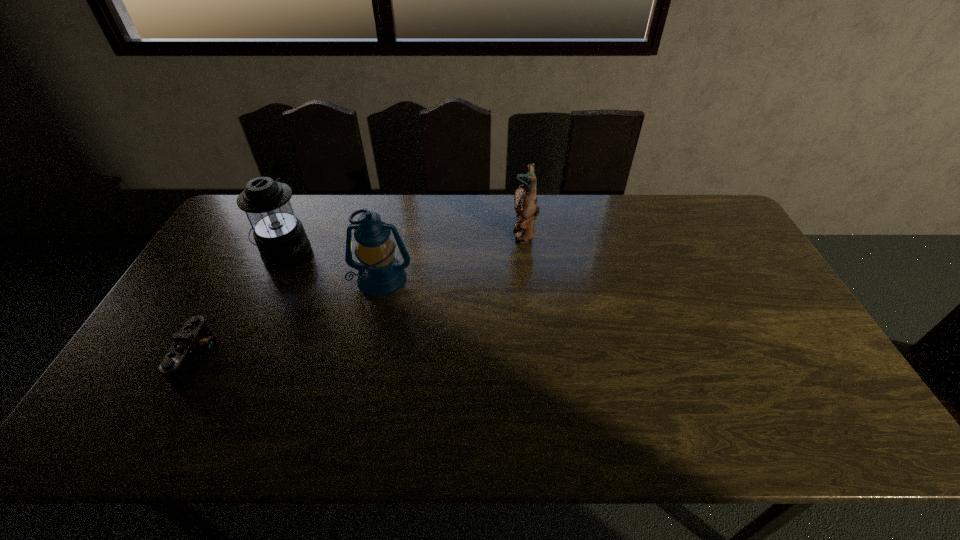
Find the location of a particular element. the left lantern is located at coordinates (279, 235).

You are a GUI agent. You are given a task and a screenshot of the screen. Output one action in this format:
    pyautogui.click(x=<x>, y=<y>)
    Task: Click on the rightmost object
    
    Given the screenshot: What is the action you would take?
    pyautogui.click(x=526, y=206)

The width and height of the screenshot is (960, 540). Find the location of `the right lantern`. the right lantern is located at coordinates (380, 273).

Locate an element on the screen. camera is located at coordinates (195, 341).

I want to click on the shortest object, so click(x=195, y=341).

The image size is (960, 540). I want to click on vacant space situated 0.400m on the front of the left lantern, so click(x=225, y=384).

I want to click on vacant region located 0.150m on the front-facing side of the rightmost object, so click(x=468, y=233).

In order to click on free region located on the front-facing side of the rightmost object in this screenshot , I will do `click(441, 233)`.

Find the location of `vacant space located 0.360m on the front-facing side of the rightmost object`. vacant space located 0.360m on the front-facing side of the rightmost object is located at coordinates (405, 233).

Find the location of a particular element. vacant space situated on the face of the right lantern is located at coordinates (354, 402).